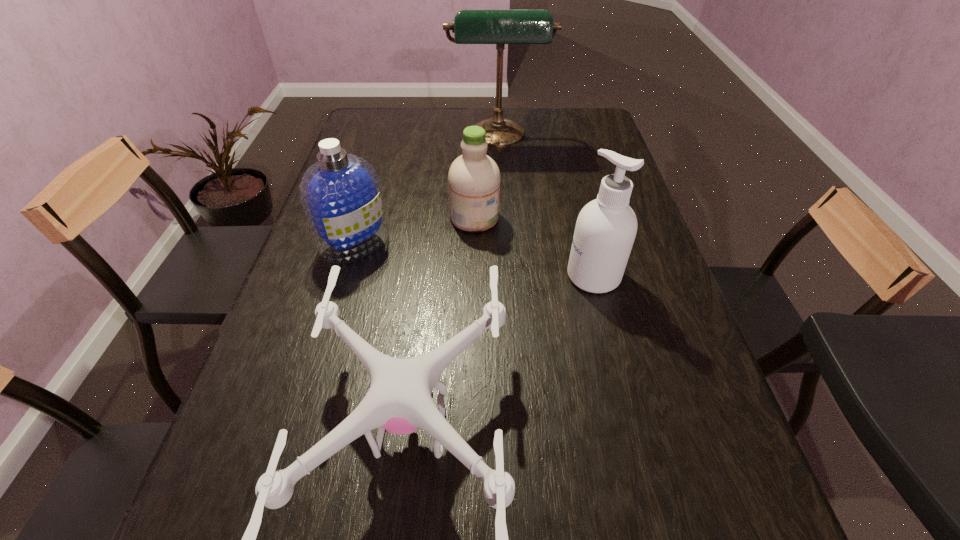
This screenshot has height=540, width=960. Find the location of `free location located 0.160m on the front label of the second cleansing agent from right to left`. free location located 0.160m on the front label of the second cleansing agent from right to left is located at coordinates (556, 218).

Identify the location of object located in the far edge section of the desktop. (500, 27).

Locate an element on the screen. The height and width of the screenshot is (540, 960). object that is at the left edge is located at coordinates (341, 196).

Image resolution: width=960 pixels, height=540 pixels. Identify the location of object that is positioned at the right edge. (606, 227).

Image resolution: width=960 pixels, height=540 pixels. In order to click on vacant space at the far edge of the desktop in this screenshot , I will do `click(405, 118)`.

Find the location of a particular element. free space at the left edge of the desktop is located at coordinates (355, 288).

Locate an element on the screen. The width and height of the screenshot is (960, 540). vacant area at the right edge is located at coordinates (681, 490).

Image resolution: width=960 pixels, height=540 pixels. Find the location of `vacant space at the far right corner of the desktop`. vacant space at the far right corner of the desktop is located at coordinates (577, 126).

Locate an element on the screen. This screenshot has height=540, width=960. vacant space that's between the second cleansing agent from left to right and the leftmost cleansing agent is located at coordinates (415, 230).

What are the coordinates of `empty space between the farthest object and the rightmost cleansing agent` in the screenshot? It's located at pos(546,207).